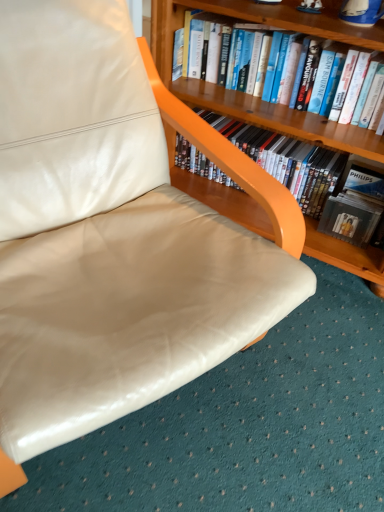
This screenshot has width=384, height=512. I want to click on matte black dvd case at upper right, marked as the second book in a top-to-bottom arrangement, so click(287, 161).

Considering the relative sizes of hardcover book at upper center, the first book when ordered from top to bottom, and matte black dvd case at upper right, which is the first book from bottom to top, in the image provided, is hardcover book at upper center, the first book when ordered from top to bottom, shorter than matte black dvd case at upper right, which is the first book from bottom to top,?

Yes.

Would you say hardcover book at upper center, the second book in the bottom-to-top sequence, is outside matte black dvd case at upper right, marked as the second book in a top-to-bottom arrangement?

Indeed, hardcover book at upper center, the second book in the bottom-to-top sequence, is completely outside matte black dvd case at upper right, marked as the second book in a top-to-bottom arrangement.

Which point is more forward, (341, 137) or (294, 143)?

The point (341, 137) is closer to the camera.

Based on the photo, between hardcover book at upper center, the second book in the bottom-to-top sequence, and wooden bookcase at upper right, which one has more height?

With more height is wooden bookcase at upper right.

How many degrees apart are the facing directions of hardcover book at upper center, the first book when ordered from top to bottom, and wooden bookcase at upper right?

They differ by 0.447 degrees in their facing directions.

Measure the distance between hardcover book at upper center, the second book in the bottom-to-top sequence, and wooden bookcase at upper right.

hardcover book at upper center, the second book in the bottom-to-top sequence, and wooden bookcase at upper right are 1.56 inches apart.

From a real-world perspective, is hardcover book at upper center, the first book when ordered from top to bottom, positioned over wooden bookcase at upper right based on gravity?

Yes, from a real-world perspective, hardcover book at upper center, the first book when ordered from top to bottom, is above wooden bookcase at upper right.

Is matte black dvd case at upper right, which is the first book from bottom to top, situated inside hardcover book at upper center, the second book in the bottom-to-top sequence, or outside?

The correct answer is: outside.

How distant is matte black dvd case at upper right, marked as the second book in a top-to-bottom arrangement, from hardcover book at upper center, the second book in the bottom-to-top sequence?

matte black dvd case at upper right, marked as the second book in a top-to-bottom arrangement, is 9.88 inches from hardcover book at upper center, the second book in the bottom-to-top sequence.

Who is smaller, matte black dvd case at upper right, which is the first book from bottom to top, or hardcover book at upper center, the first book when ordered from top to bottom?

hardcover book at upper center, the first book when ordered from top to bottom.

Which object is wider, matte black dvd case at upper right, marked as the second book in a top-to-bottom arrangement, or hardcover book at upper center, the second book in the bottom-to-top sequence?

matte black dvd case at upper right, marked as the second book in a top-to-bottom arrangement.

Are matte black dvd case at upper right, which is the first book from bottom to top, and wooden bookcase at upper right located far from each other?

No, there isn't a large distance between matte black dvd case at upper right, which is the first book from bottom to top, and wooden bookcase at upper right.

Between matte black dvd case at upper right, marked as the second book in a top-to-bottom arrangement, and wooden bookcase at upper right, which one has larger size?

wooden bookcase at upper right is bigger.

Based on the photo, is matte black dvd case at upper right, which is the first book from bottom to top, in front of or behind wooden bookcase at upper right in the image?

matte black dvd case at upper right, which is the first book from bottom to top, is behind wooden bookcase at upper right.

Which point is more distant from viewer, (256, 151) or (315, 133)?

The point (256, 151) is farther.

Consider the image. Is wooden bookcase at upper right in contact with hardcover book at upper center, the second book in the bottom-to-top sequence?

Absolutely, wooden bookcase at upper right is next to and touching hardcover book at upper center, the second book in the bottom-to-top sequence.

Between wooden bookcase at upper right and hardcover book at upper center, the second book in the bottom-to-top sequence, which one appears on the left side from the viewer's perspective?

Positioned to the left is hardcover book at upper center, the second book in the bottom-to-top sequence.

Based on the photo, how different are the orientations of wooden bookcase at upper right and hardcover book at upper center, the second book in the bottom-to-top sequence, in degrees?

The angular difference between wooden bookcase at upper right and hardcover book at upper center, the second book in the bottom-to-top sequence, is 0.447 degrees.

Can you confirm if wooden bookcase at upper right is positioned to the right of matte black dvd case at upper right, marked as the second book in a top-to-bottom arrangement?

In fact, wooden bookcase at upper right is to the left of matte black dvd case at upper right, marked as the second book in a top-to-bottom arrangement.

Is wooden bookcase at upper right oriented towards matte black dvd case at upper right, which is the first book from bottom to top?

Yes, wooden bookcase at upper right is turned towards matte black dvd case at upper right, which is the first book from bottom to top.

Is wooden bookcase at upper right taller than matte black dvd case at upper right, marked as the second book in a top-to-bottom arrangement?

Indeed, wooden bookcase at upper right has a greater height compared to matte black dvd case at upper right, marked as the second book in a top-to-bottom arrangement.

Locate an element on the screen. The image size is (384, 512). book on the left of matte black dvd case at upper right, marked as the second book in a top-to-bottom arrangement is located at coordinates (273, 23).

I want to click on book above the wooden bookcase at upper right (from the image's perspective), so click(273, 23).

Considering their positions, is wooden bookcase at upper right positioned closer to matte black dvd case at upper right, which is the first book from bottom to top, than hardcover book at upper center, the first book when ordered from top to bottom?

The object closer to matte black dvd case at upper right, which is the first book from bottom to top, is wooden bookcase at upper right.

Which object lies further to the anchor point hardcover book at upper center, the first book when ordered from top to bottom, matte black dvd case at upper right, marked as the second book in a top-to-bottom arrangement, or wooden bookcase at upper right?

Based on the image, matte black dvd case at upper right, marked as the second book in a top-to-bottom arrangement, appears to be further to hardcover book at upper center, the first book when ordered from top to bottom.

Estimate the real-world distances between objects in this image. Which object is closer to matte black dvd case at upper right, marked as the second book in a top-to-bottom arrangement, hardcover book at upper center, the second book in the bottom-to-top sequence, or wooden bookcase at upper right?

wooden bookcase at upper right lies closer to matte black dvd case at upper right, marked as the second book in a top-to-bottom arrangement, than the other object.

Looking at the image, which one is located further to wooden bookcase at upper right, hardcover book at upper center, the second book in the bottom-to-top sequence, or matte black dvd case at upper right, marked as the second book in a top-to-bottom arrangement?

Based on the image, matte black dvd case at upper right, marked as the second book in a top-to-bottom arrangement, appears to be further to wooden bookcase at upper right.

Considering their positions, is wooden bookcase at upper right positioned further to hardcover book at upper center, the second book in the bottom-to-top sequence, than matte black dvd case at upper right, which is the first book from bottom to top?

Based on the image, matte black dvd case at upper right, which is the first book from bottom to top, appears to be further to hardcover book at upper center, the second book in the bottom-to-top sequence.

When comparing their distances from wooden bookcase at upper right, does matte black dvd case at upper right, marked as the second book in a top-to-bottom arrangement, or hardcover book at upper center, the second book in the bottom-to-top sequence, seem closer?

Among the two, hardcover book at upper center, the second book in the bottom-to-top sequence, is located nearer to wooden bookcase at upper right.

What are the coordinates of `book between wooden bookcase at upper right and matte black dvd case at upper right, marked as the second book in a top-to-bottom arrangement, from front to back` in the screenshot? It's located at (273, 23).